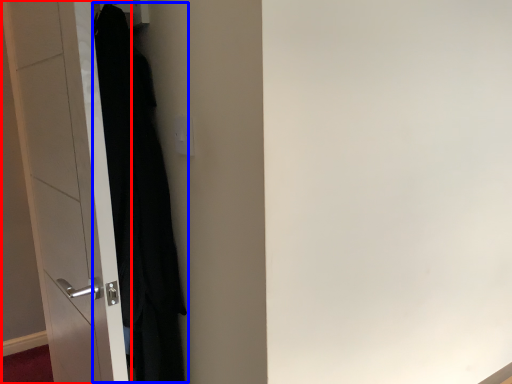
Question: Which point is further to the camera, door (highlighted by a red box) or clothing (highlighted by a blue box)?

Choices:
 (A) door
 (B) clothing

Answer: (B)